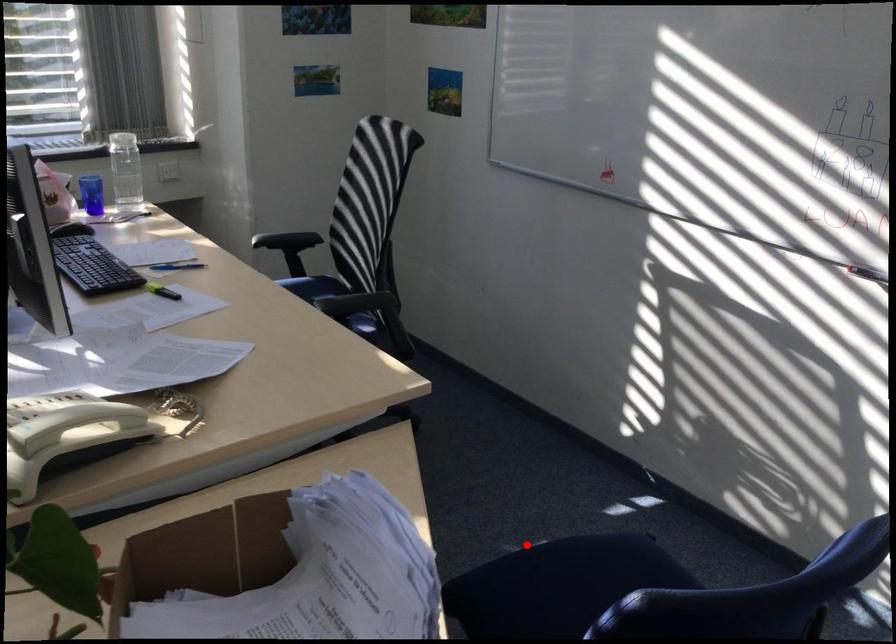
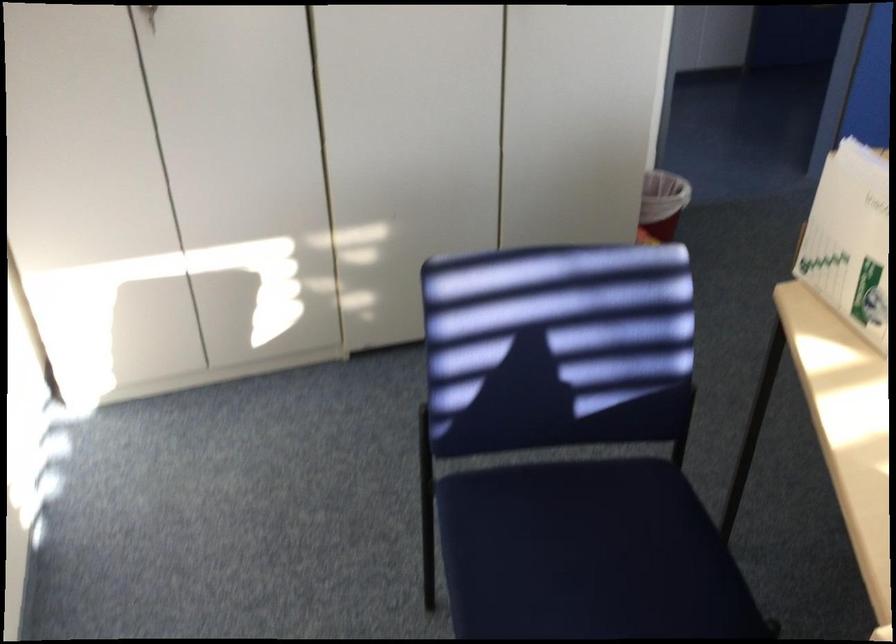
In the second image, find the point that corresponds to the highlighted location in the first image.

(588, 554)